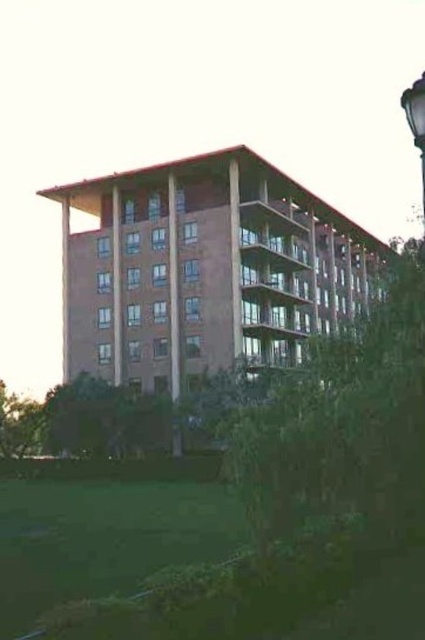
Does brown brick building at center appear over black metal street light at upper right?

No.

Which of these two, brown brick building at center or black metal street light at upper right, stands shorter?

brown brick building at center is shorter.

What do you see at coordinates (204, 269) in the screenshot? I see `brown brick building at center` at bounding box center [204, 269].

The height and width of the screenshot is (640, 425). Identify the location of brown brick building at center. (204, 269).